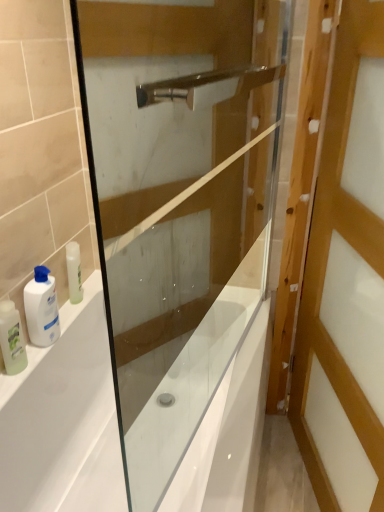
Question: Considering the positions of white glossy bathtub at lower left and wooden door at right in the image, is white glossy bathtub at lower left taller or shorter than wooden door at right?

Choices:
 (A) tall
 (B) short

Answer: (B)

Question: Based on their positions, is white glossy bathtub at lower left located to the left or right of wooden door at right?

Choices:
 (A) right
 (B) left

Answer: (B)

Question: Estimate the real-world distances between objects in this image. Which object is closer to the wooden door at right?

Choices:
 (A) white glossy lotion at left, which is the 2th toiletry in left-to-right order
 (B) white glossy bathtub at lower left
 (C) translucent plastic bottle at left, which appears as the first toiletry when viewed from the left
 (D) transparent glass screen door at center

Answer: (D)

Question: Which is farther from the wooden door at right?

Choices:
 (A) translucent plastic bottle at left, arranged as the second toiletry when viewed from the right
 (B) white glossy lotion at left, which is the 2th toiletry in left-to-right order
 (C) white glossy bathtub at lower left
 (D) transparent glass screen door at center

Answer: (A)